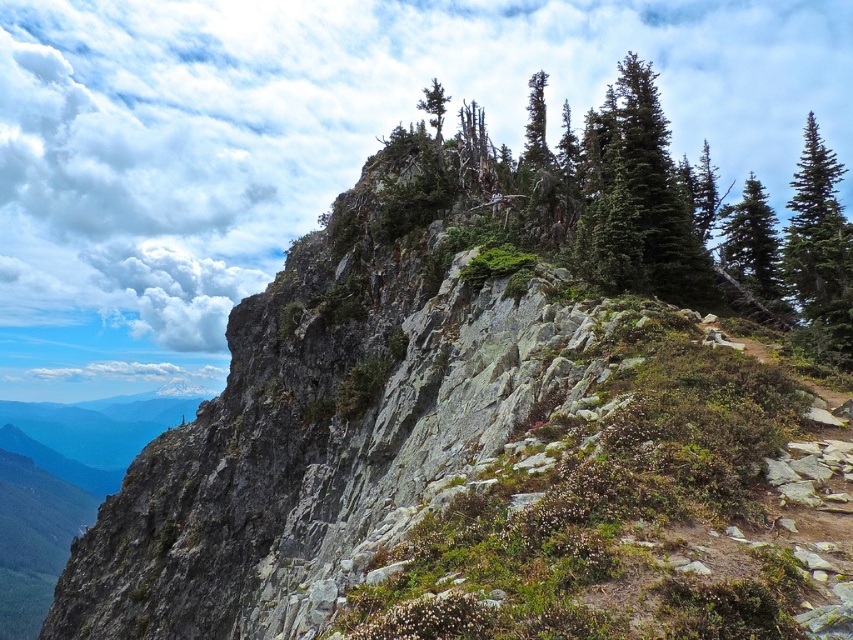
Who is positioned more to the left, green textured rock at upper center or green matte tree at upper right?

From the viewer's perspective, green matte tree at upper right appears more on the left side.

Is point (606, 145) positioned before point (755, 211)?

Yes.

The height and width of the screenshot is (640, 853). I want to click on green textured rock at upper center, so click(647, 211).

Does green textured pine tree at upper right appear on the right side of green matte tree at upper right?

Yes, green textured pine tree at upper right is to the right of green matte tree at upper right.

I want to click on green textured pine tree at upper right, so click(x=819, y=243).

Find the location of a particular element. This screenshot has width=853, height=640. green textured pine tree at upper right is located at coordinates (819, 243).

The height and width of the screenshot is (640, 853). What do you see at coordinates (819, 243) in the screenshot?
I see `green textured pine tree at upper right` at bounding box center [819, 243].

Who is higher up, green textured pine tree at upper right or green matte tree at upper center?

green matte tree at upper center is higher up.

The height and width of the screenshot is (640, 853). Identify the location of green textured pine tree at upper right. (819, 243).